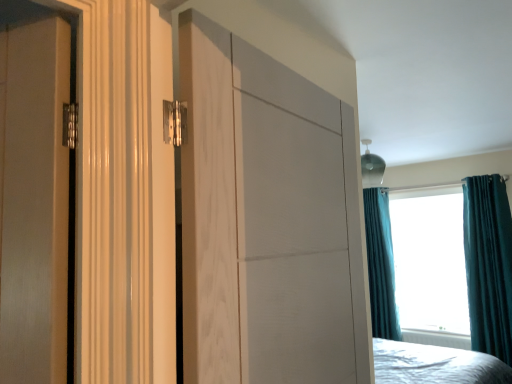
Question: Considering the relative sizes of white plastic radiator at lower center and white wood door at center in the image provided, is white plastic radiator at lower center smaller than white wood door at center?

Choices:
 (A) no
 (B) yes

Answer: (B)

Question: Considering the relative positions of white plastic radiator at lower center and white wood door at center in the image provided, is white plastic radiator at lower center to the right of white wood door at center from the viewer's perspective?

Choices:
 (A) yes
 (B) no

Answer: (A)

Question: Can you confirm if white plastic radiator at lower center is positioned to the left of white wood door at center?

Choices:
 (A) yes
 (B) no

Answer: (B)

Question: From the image's perspective, is white plastic radiator at lower center above white wood door at center?

Choices:
 (A) yes
 (B) no

Answer: (B)

Question: Can white wood door at center be found inside white plastic radiator at lower center?

Choices:
 (A) yes
 (B) no

Answer: (B)

Question: Is white wood door at center bigger or smaller than teal velvet curtain at right, positioned as the second curtain in back-to-front order?

Choices:
 (A) big
 (B) small

Answer: (B)

Question: Is white wood door at center taller or shorter than teal velvet curtain at right, positioned as the second curtain in back-to-front order?

Choices:
 (A) tall
 (B) short

Answer: (B)

Question: Considering the positions of point [287, 89] and point [493, 243], is point [287, 89] closer or farther from the camera than point [493, 243]?

Choices:
 (A) closer
 (B) farther

Answer: (A)

Question: Relative to teal velvet curtain at right, which is the 2th curtain in left-to-right order, is white wood door at center in front or behind?

Choices:
 (A) behind
 (B) front

Answer: (B)

Question: Is point (493, 354) positioned closer to the camera than point (444, 332)?

Choices:
 (A) closer
 (B) farther

Answer: (A)

Question: Looking at the image, does teal velvet curtain at right, the first curtain positioned from the right, seem bigger or smaller compared to white plastic radiator at lower center?

Choices:
 (A) small
 (B) big

Answer: (B)

Question: Is teal velvet curtain at right, the first curtain positioned from the right, to the left or to the right of white plastic radiator at lower center in the image?

Choices:
 (A) left
 (B) right

Answer: (B)

Question: In terms of height, does teal velvet curtain at right, arranged as the 1th curtain when viewed from the front, look taller or shorter compared to white plastic radiator at lower center?

Choices:
 (A) short
 (B) tall

Answer: (B)

Question: From a real-world perspective, is teal velvet curtain at upper right positioned above or below teal velvet curtain at right, the 2th curtain viewed from the right?

Choices:
 (A) above
 (B) below

Answer: (A)

Question: Would you say teal velvet curtain at upper right is to the left or to the right of teal velvet curtain at right, the 2th curtain viewed from the right, in the picture?

Choices:
 (A) left
 (B) right

Answer: (B)